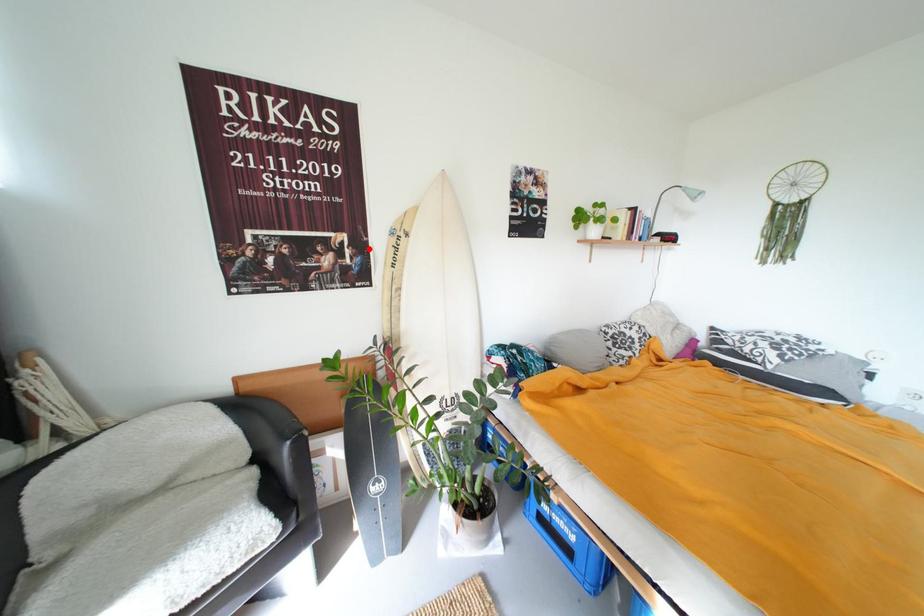
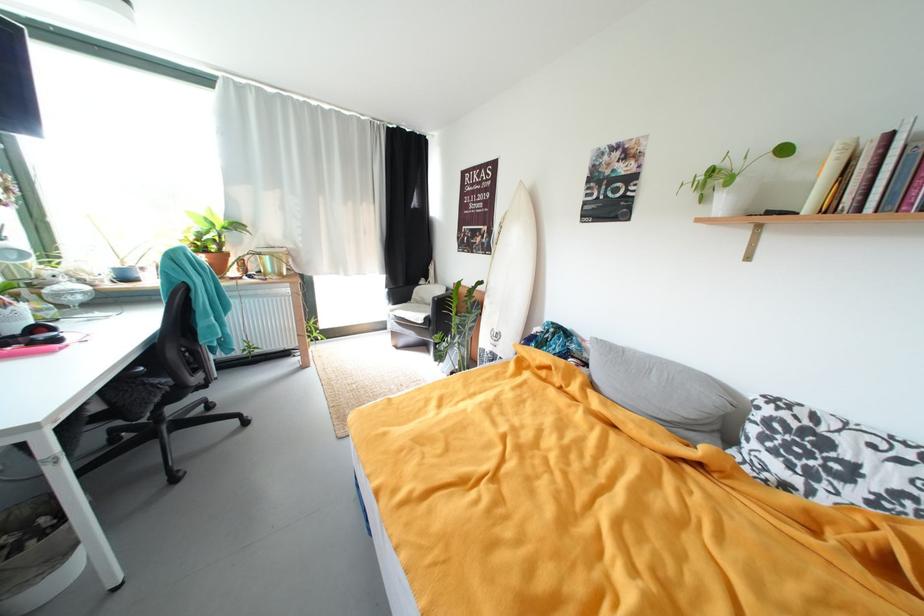
In the second image, find the point that corresponds to the highlighted location in the first image.

(497, 235)